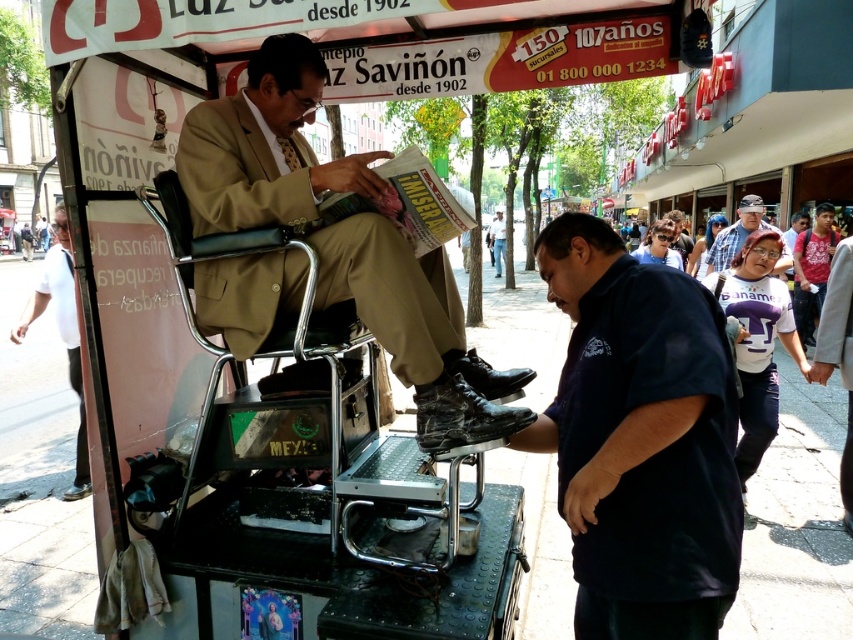
You are standing at the camera position and want to throw a ball to hit the point at coordinates point (67, 291). If your throwing range is up to 5 meters, will you be able to reach it?

The distance of point (67, 291) from the camera is 4.75 meters, so yes, you can reach it since it is within your throwing range of up to 5 meters.

Based on the scene description, what are the coordinates of the matte brown suit at center?

The coordinates of the matte brown suit at center are at point (x=416, y=330).

You are a photographer trying to capture the scene of the shoe shining service. You want to ensure both the matte brown suit at center and the blue denim shirt at center are clearly visible in your photo. Based on their positions, which object should you focus on first to ensure both are in frame?

The matte brown suit at center is positioned under the blue denim shirt at center. To ensure both are in frame, focus on the blue denim shirt at center first since it is above the matte brown suit at center, allowing the lower positioned suit to naturally fall into the shot.